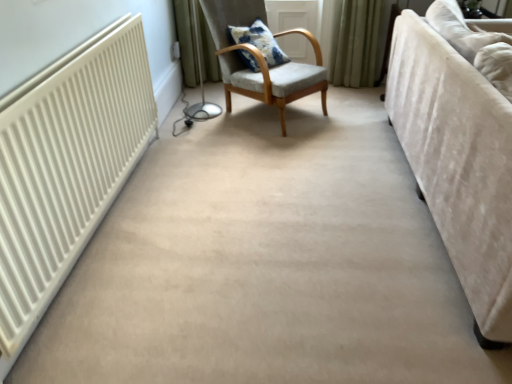
Measure the distance between blue printed cushion at center and camera.

The depth of blue printed cushion at center is 3.01 meters.

Where is `velvet beige couch at right`? velvet beige couch at right is located at coordinates (458, 163).

What is the approximate width of light gray fabric chair at center?

The width of light gray fabric chair at center is 34.68 inches.

Where is `blue printed cushion at center`? Image resolution: width=512 pixels, height=384 pixels. blue printed cushion at center is located at coordinates (259, 41).

Is blue printed cushion at center turned away from light gray fabric chair at center?

Yes, blue printed cushion at center's orientation is away from light gray fabric chair at center.

Find the location of `chair that appears in front of the blue printed cushion at center`. chair that appears in front of the blue printed cushion at center is located at coordinates (275, 77).

Which object is positioned more to the right, blue printed cushion at center or light gray fabric chair at center?

Positioned to the right is light gray fabric chair at center.

From the image's perspective, between velvet beige couch at right and blue printed cushion at center, who is located below?

From the image's view, velvet beige couch at right is below.

How distant is velvet beige couch at right from blue printed cushion at center?

velvet beige couch at right and blue printed cushion at center are 4.30 feet apart from each other.

Which is in front, point (482, 155) or point (255, 29)?

The point (482, 155) is closer.

Is point (302, 89) farther from viewer compared to point (267, 38)?

No.

Between light gray fabric chair at center and blue printed cushion at center, which one has less height?

blue printed cushion at center is shorter.

Considering the relative positions of light gray fabric chair at center and blue printed cushion at center in the image provided, is light gray fabric chair at center to the right of blue printed cushion at center from the viewer's perspective?

Yes.

Measure the distance between light gray fabric chair at center and blue printed cushion at center.

The distance of light gray fabric chair at center from blue printed cushion at center is 5.84 inches.

Is light gray fabric chair at center beside velvet beige couch at right?

light gray fabric chair at center and velvet beige couch at right are not in contact.

From the image's perspective, is light gray fabric chair at center above or below velvet beige couch at right?

light gray fabric chair at center is situated higher than velvet beige couch at right in the image.

Is light gray fabric chair at center aimed at velvet beige couch at right?

Yes, light gray fabric chair at center is oriented towards velvet beige couch at right.

Considering the relative positions of light gray fabric chair at center and velvet beige couch at right in the image provided, is light gray fabric chair at center to the left of velvet beige couch at right from the viewer's perspective?

Correct, you'll find light gray fabric chair at center to the left of velvet beige couch at right.

From the image's perspective, relative to light gray fabric chair at center, is velvet beige couch at right above or below?

velvet beige couch at right is below light gray fabric chair at center.

Are velvet beige couch at right and light gray fabric chair at center located far from each other?

Absolutely, velvet beige couch at right is distant from light gray fabric chair at center.

Which is more to the left, velvet beige couch at right or light gray fabric chair at center?

light gray fabric chair at center is more to the left.

Is blue printed cushion at center touching velvet beige couch at right?

They are not placed beside each other.

Is point (245, 28) positioned in front of point (485, 251)?

No.

Based on the photo, who is more distant, blue printed cushion at center or velvet beige couch at right?

Positioned behind is blue printed cushion at center.

Does blue printed cushion at center have a greater height compared to velvet beige couch at right?

No.

I want to click on chair below the blue printed cushion at center (from the image's perspective), so click(x=275, y=77).

Find the location of a particular element. Image resolution: width=512 pixels, height=384 pixels. pillow above the velvet beige couch at right (from the image's perspective) is located at coordinates (259, 41).

Considering their positions, is blue printed cushion at center positioned closer to light gray fabric chair at center than velvet beige couch at right?

Among the two, blue printed cushion at center is located nearer to light gray fabric chair at center.

Looking at the image, which one is located further to blue printed cushion at center, light gray fabric chair at center or velvet beige couch at right?

velvet beige couch at right is positioned further to the anchor blue printed cushion at center.

Based on their spatial positions, is velvet beige couch at right or blue printed cushion at center closer to light gray fabric chair at center?

Based on the image, blue printed cushion at center appears to be nearer to light gray fabric chair at center.

Estimate the real-world distances between objects in this image. Which object is further from velvet beige couch at right, blue printed cushion at center or light gray fabric chair at center?

blue printed cushion at center.

Based on their spatial positions, is light gray fabric chair at center or blue printed cushion at center further from velvet beige couch at right?

blue printed cushion at center.

Looking at the image, which one is located closer to blue printed cushion at center, velvet beige couch at right or light gray fabric chair at center?

light gray fabric chair at center is positioned closer to the anchor blue printed cushion at center.

You are a GUI agent. You are given a task and a screenshot of the screen. Output one action in this format:
    pyautogui.click(x=<x>, y=<y>)
    Task: Click on the chair between velvet beige couch at right and blue printed cushion at center along the z-axis
    
    Given the screenshot: What is the action you would take?
    pyautogui.click(x=275, y=77)